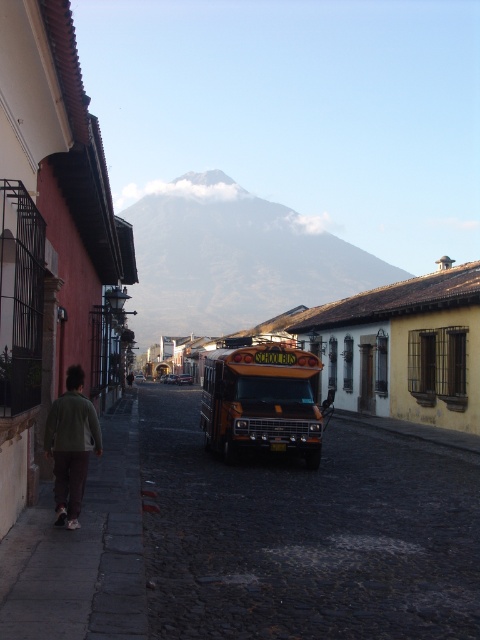
Who is lower down, cobblestone pavement at center or green fabric jacket at lower left?

cobblestone pavement at center is below.

Is point (396, 548) positioned behind point (94, 426)?

No, it is not.

Where is `cobblestone pavement at center`? The width and height of the screenshot is (480, 640). cobblestone pavement at center is located at coordinates (305, 534).

Does point (273, 432) come closer to viewer compared to point (84, 436)?

That is False.

Who is positioned more to the right, yellow metallic school bus at center or green fabric jacket at lower left?

Positioned to the right is yellow metallic school bus at center.

This screenshot has height=640, width=480. Describe the element at coordinates (261, 401) in the screenshot. I see `yellow metallic school bus at center` at that location.

Image resolution: width=480 pixels, height=640 pixels. What are the coordinates of `yellow metallic school bus at center` in the screenshot? It's located at (261, 401).

Consider the image. Who is positioned more to the right, cobblestone pavement at center or yellow metallic school bus at center?

Positioned to the right is yellow metallic school bus at center.

Is cobblestone pavement at center smaller than yellow metallic school bus at center?

Yes, cobblestone pavement at center is smaller than yellow metallic school bus at center.

Identify the location of cobblestone pavement at center. The height and width of the screenshot is (640, 480). (305, 534).

Where is `cobblestone pavement at center`? The image size is (480, 640). cobblestone pavement at center is located at coordinates (305, 534).